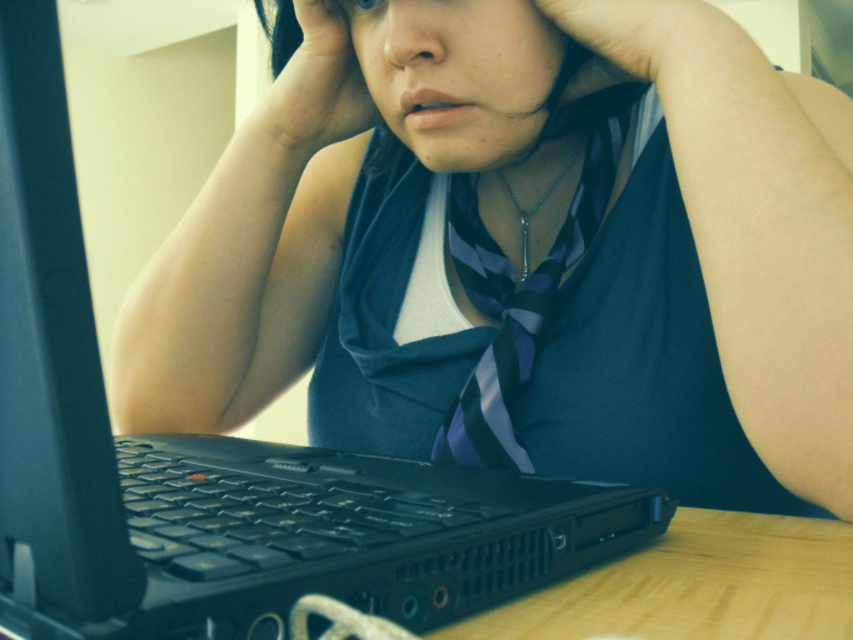
Question: Where is matte black laptop at lower left located in relation to matte skin hand at center in the image?

Choices:
 (A) below
 (B) above

Answer: (A)

Question: Which of the following is the farthest from the observer?

Choices:
 (A) matte skin hand at center
 (B) striped silk tie at center
 (C) matte skin hand at upper center
 (D) matte black laptop at lower left

Answer: (A)

Question: Based on their relative distances, which object is nearer to the striped silk tie at center?

Choices:
 (A) matte skin hand at upper center
 (B) matte skin hand at center
 (C) matte black laptop at lower left

Answer: (C)

Question: Estimate the real-world distances between objects in this image. Which object is closer to the matte skin hand at upper center?

Choices:
 (A) matte black laptop at lower left
 (B) striped silk tie at center
 (C) matte skin hand at center

Answer: (B)

Question: Is striped silk tie at center to the right of matte skin hand at upper center from the viewer's perspective?

Choices:
 (A) no
 (B) yes

Answer: (A)

Question: Can you confirm if matte skin hand at upper center is thinner than matte skin hand at center?

Choices:
 (A) yes
 (B) no

Answer: (A)